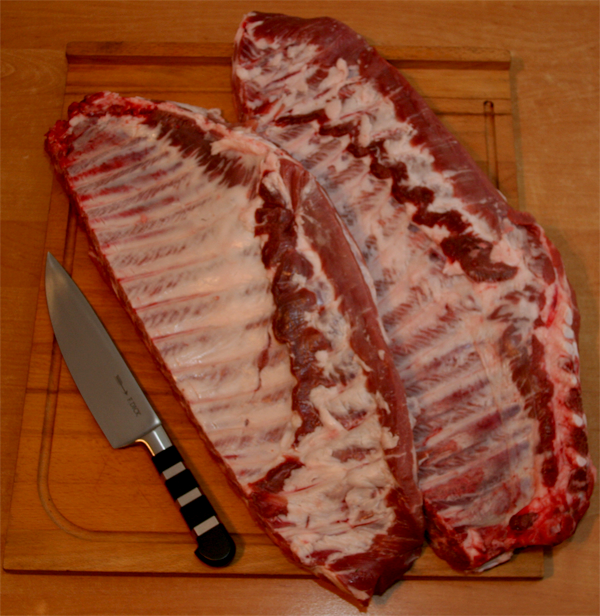
What are the coordinates of `cutting board` in the screenshot? It's located at (68, 507).